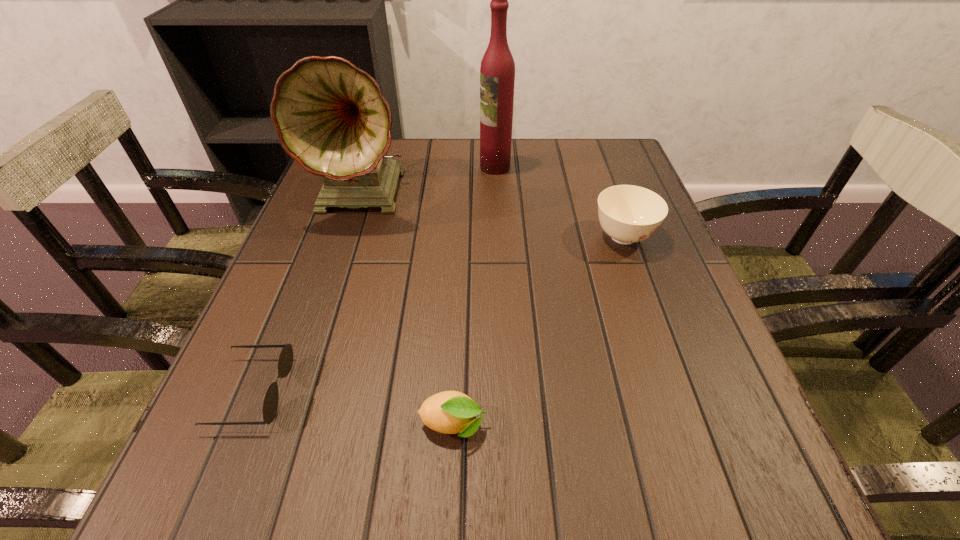
I want to click on unoccupied position between the liquor and the second shortest object, so click(x=474, y=296).

Locate an element on the screen. empty space that is in between the sugar bowl and the liquor is located at coordinates (559, 202).

Identify the location of vacant area that lies between the sugar bowl and the liquor. This screenshot has width=960, height=540. (559, 202).

Locate an element on the screen. free area in between the rightmost object and the record player is located at coordinates (494, 216).

Find the location of `vacant space in between the sunglasses and the liquor`. vacant space in between the sunglasses and the liquor is located at coordinates (373, 279).

Where is `free area in between the third shortest object and the liquor`? free area in between the third shortest object and the liquor is located at coordinates (559, 202).

The image size is (960, 540). I want to click on object that can be found as the third closest to the lemon, so click(331, 117).

Identify the location of the fourth closest object relative to the lemon. The height and width of the screenshot is (540, 960). (497, 72).

I want to click on blank area in the image that satisfies the following two spatial constraints: 1. from the horn of the record player; 2. on the front-facing side of the sunglasses, so click(x=303, y=392).

Find the location of a particular element. This screenshot has width=960, height=540. vacant area that satisfies the following two spatial constraints: 1. from the horn of the record player; 2. on the front-facing side of the sunglasses is located at coordinates 303,392.